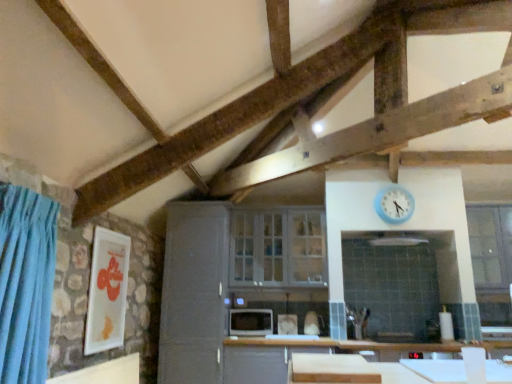
Question: Are matte black microwave at center and white matte cutting board at lower center located far from each other?

Choices:
 (A) no
 (B) yes

Answer: (A)

Question: Considering the relative sizes of matte black microwave at center and white matte cutting board at lower center in the image provided, is matte black microwave at center shorter than white matte cutting board at lower center?

Choices:
 (A) yes
 (B) no

Answer: (B)

Question: Does matte black microwave at center have a greater width compared to white matte cutting board at lower center?

Choices:
 (A) no
 (B) yes

Answer: (A)

Question: From a real-world perspective, is matte black microwave at center located beneath white matte cutting board at lower center?

Choices:
 (A) no
 (B) yes

Answer: (A)

Question: Does matte black microwave at center turn towards white matte cutting board at lower center?

Choices:
 (A) yes
 (B) no

Answer: (A)

Question: From a real-world perspective, relative to satin gray cabinet at center, is clear glass window at right, positioned as the 2th window in left-to-right order, vertically above or below?

Choices:
 (A) above
 (B) below

Answer: (A)

Question: Is clear glass window at right, acting as the first window starting from the right, wider or thinner than satin gray cabinet at center?

Choices:
 (A) thin
 (B) wide

Answer: (A)

Question: Is clear glass window at right, acting as the first window starting from the right, taller or shorter than satin gray cabinet at center?

Choices:
 (A) short
 (B) tall

Answer: (A)

Question: Is clear glass window at right, positioned as the 2th window in left-to-right order, in front of or behind satin gray cabinet at center in the image?

Choices:
 (A) front
 (B) behind

Answer: (B)

Question: Looking at the image, does white matte cutting board at lower center seem bigger or smaller compared to matte black microwave at center?

Choices:
 (A) small
 (B) big

Answer: (A)

Question: From the image's perspective, is white matte cutting board at lower center above or below matte black microwave at center?

Choices:
 (A) above
 (B) below

Answer: (A)

Question: From a real-world perspective, is white matte cutting board at lower center above or below matte black microwave at center?

Choices:
 (A) above
 (B) below

Answer: (B)

Question: Relative to matte black microwave at center, is white matte cutting board at lower center in front or behind?

Choices:
 (A) front
 (B) behind

Answer: (A)

Question: Considering their positions, is blue plastic clock at upper right located in front of or behind white glass cabinet at center, acting as the 2th window starting from the right?

Choices:
 (A) behind
 (B) front

Answer: (B)

Question: Is blue plastic clock at upper right to the left or to the right of white glass cabinet at center, marked as the first window in a left-to-right arrangement, in the image?

Choices:
 (A) left
 (B) right

Answer: (B)